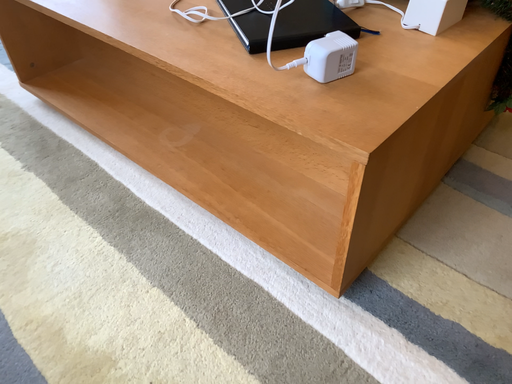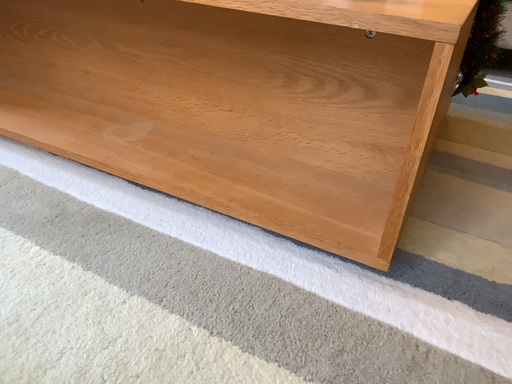
Question: Which way did the camera rotate in the video?

Choices:
 (A) rotated right
 (B) rotated left

Answer: (A)